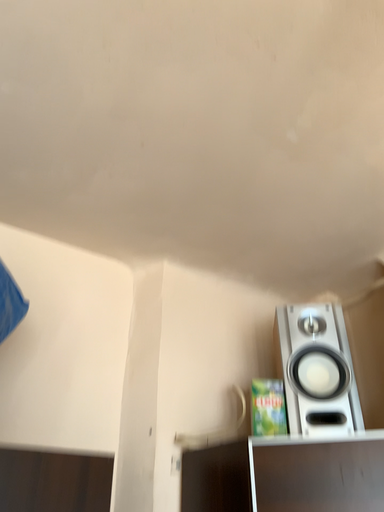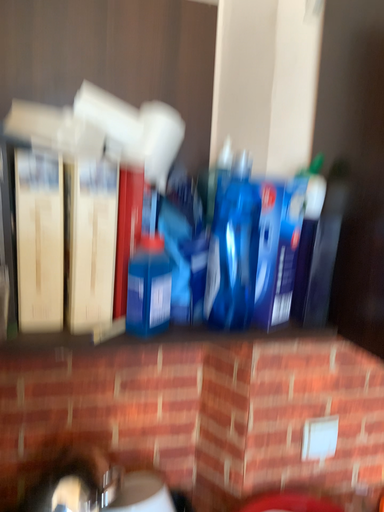
Question: Which way did the camera rotate in the video?

Choices:
 (A) rotated right
 (B) rotated left

Answer: (B)